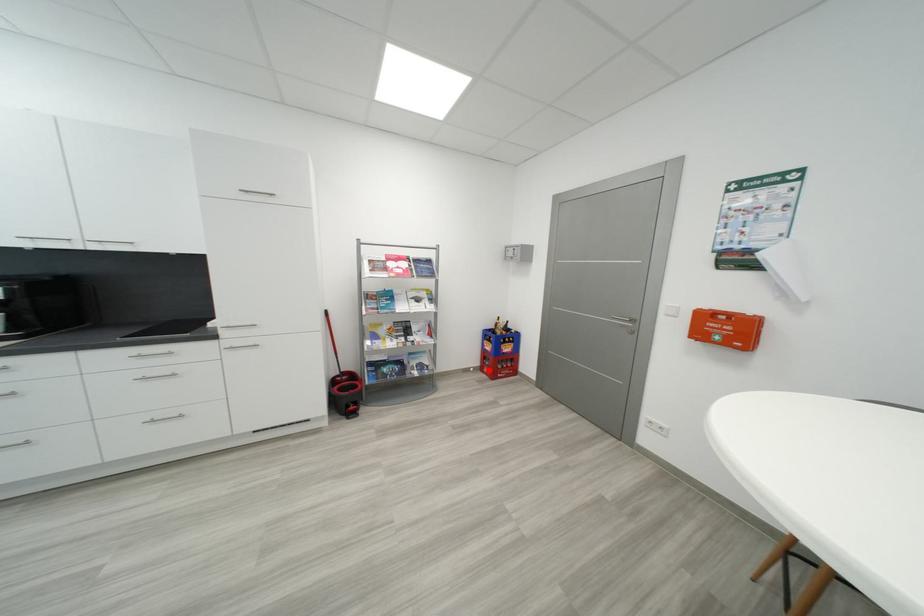
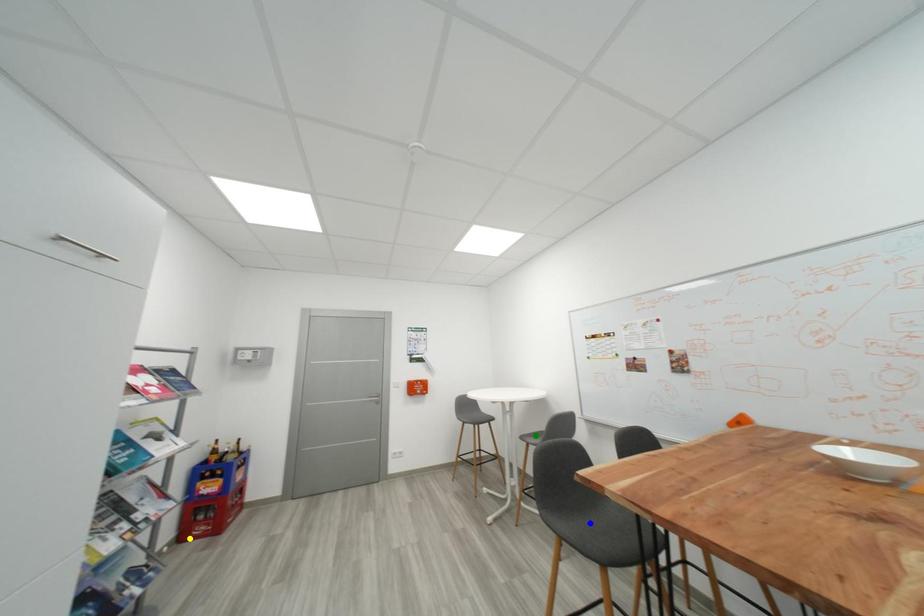
Question: I am providing you with two images of the same scene from different viewpoints. A red point is marked on the first image. You are given multiple points on the second image. In image 2, which mark is for the same physical point as the one in image 1?

Choices:
 (A) yellow point
 (B) green point
 (C) blue point

Answer: (A)